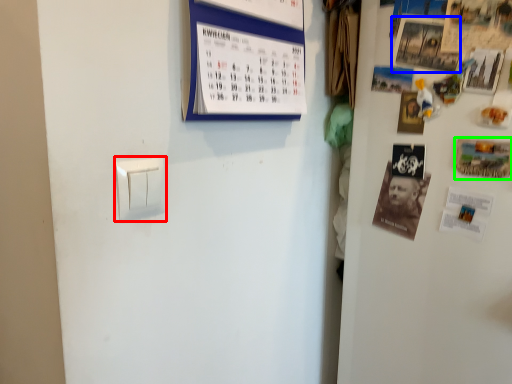
Question: Which object is the closest to the light switch (highlighted by a red box)? Choose among these: poster (highlighted by a blue box) or postcard (highlighted by a green box).

Choices:
 (A) poster
 (B) postcard

Answer: (A)